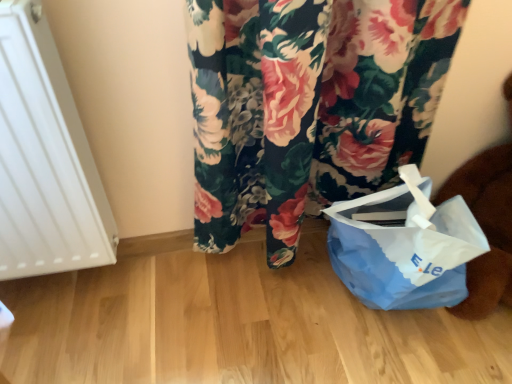
Question: Considering the positions of blue paper bag at lower right and white matte radiator at left in the image, is blue paper bag at lower right wider or thinner than white matte radiator at left?

Choices:
 (A) wide
 (B) thin

Answer: (A)

Question: From the image's perspective, is blue paper bag at lower right located above or below white matte radiator at left?

Choices:
 (A) below
 (B) above

Answer: (A)

Question: Is blue paper bag at lower right inside the boundaries of white matte radiator at left, or outside?

Choices:
 (A) inside
 (B) outside

Answer: (B)

Question: In terms of width, does white matte radiator at left look wider or thinner when compared to blue paper bag at lower right?

Choices:
 (A) wide
 (B) thin

Answer: (B)

Question: From the image's perspective, relative to blue paper bag at lower right, is white matte radiator at left above or below?

Choices:
 (A) above
 (B) below

Answer: (A)

Question: Does point (12, 153) appear closer or farther from the camera than point (424, 193)?

Choices:
 (A) farther
 (B) closer

Answer: (B)

Question: Considering their positions, is white matte radiator at left located in front of or behind blue paper bag at lower right?

Choices:
 (A) front
 (B) behind

Answer: (A)